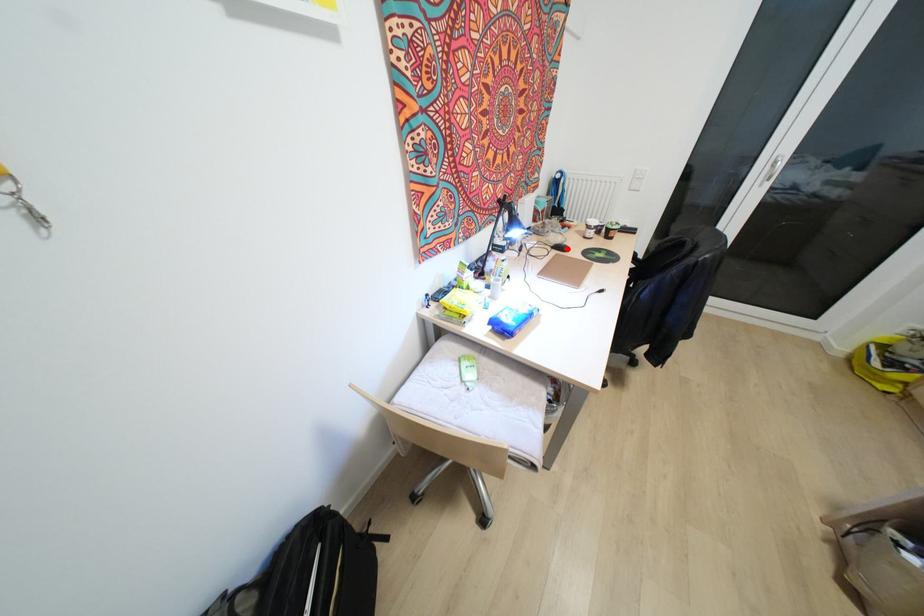
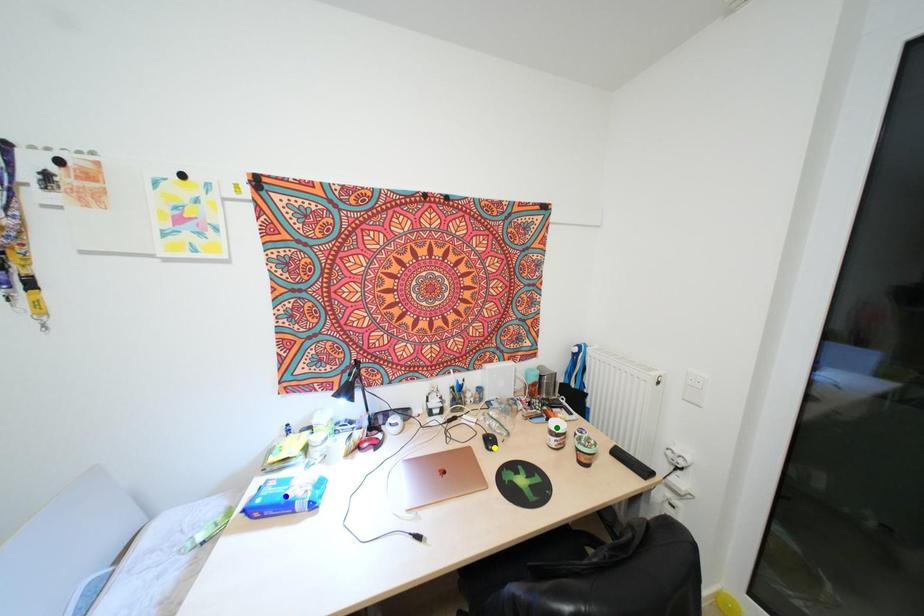
Question: I am providing you with two images of the same scene from different viewpoints. A red point is marked on the first image. You are given multiple points on the second image. Which point in image 2 is actually the same real-world point as the red point in image 1?

Choices:
 (A) yellow point
 (B) green point
 (C) blue point

Answer: (A)